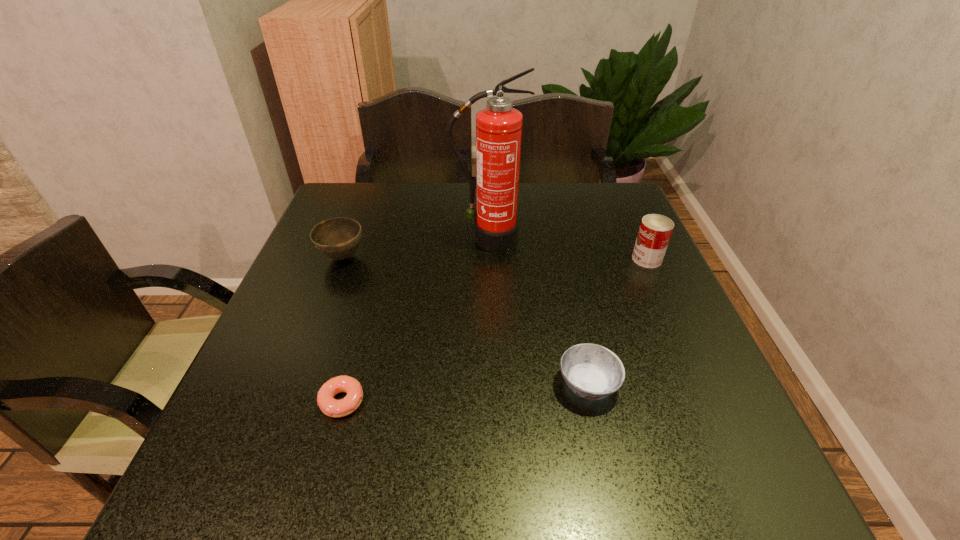
Where is `empty location between the fourth object from left to right and the shortest object`? The height and width of the screenshot is (540, 960). empty location between the fourth object from left to right and the shortest object is located at coordinates (466, 393).

Image resolution: width=960 pixels, height=540 pixels. I want to click on free space between the bowl and the second object from right to left, so click(x=466, y=321).

At what (x,y) coordinates should I click in order to perform the action: click on blank region between the bowl and the doughnut. Please return your answer as a coordinate pair (x, y). The image size is (960, 540). Looking at the image, I should click on (343, 329).

Identify which object is the second closest to the rightmost object. Please provide its 2D coordinates. Your answer should be formatted as a tuple, i.e. [(x, y)], where the tuple contains the x and y coordinates of a point satisfying the conditions above.

[(591, 371)]

At what (x,y) coordinates should I click in order to perform the action: click on the closest object to the doughnut. Please return your answer as a coordinate pair (x, y). This screenshot has height=540, width=960. Looking at the image, I should click on (338, 238).